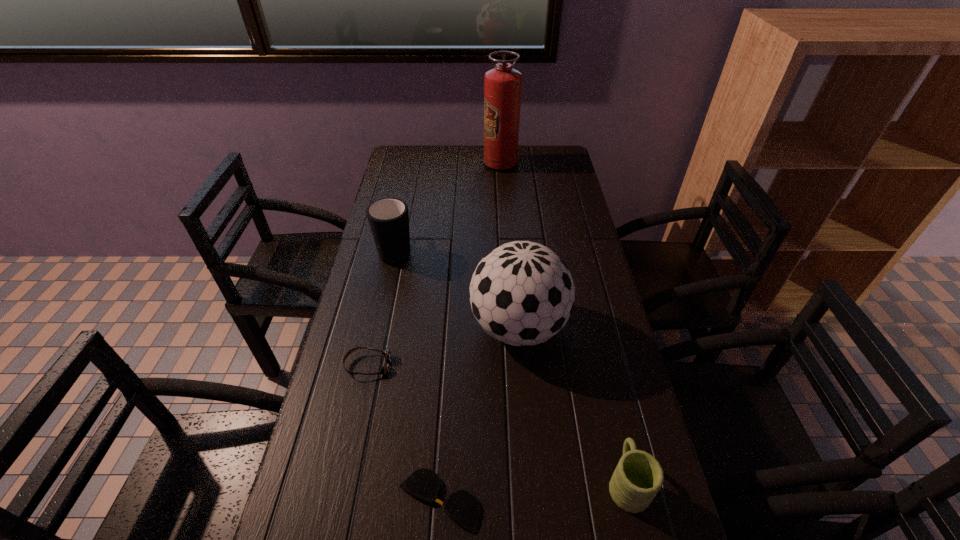
Find the location of a particular element. This screenshot has height=540, width=960. blank space located 0.210m on the label side of the farthest object is located at coordinates (433, 164).

Where is `blank space located 0.330m on the label side of the farthest object`? The height and width of the screenshot is (540, 960). blank space located 0.330m on the label side of the farthest object is located at coordinates (404, 164).

Find the location of a particular element. vacant space located 0.230m on the back of the second tallest object is located at coordinates (512, 244).

Find the location of a particular element. vacant space located on the side of the second farthest object with the handle is located at coordinates (409, 190).

Image resolution: width=960 pixels, height=540 pixels. I want to click on vacant space situated 0.150m on the side of the second farthest object with the handle, so click(x=405, y=207).

The image size is (960, 540). Find the location of `free region located on the side of the second farthest object with the handle`. free region located on the side of the second farthest object with the handle is located at coordinates (407, 196).

Image resolution: width=960 pixels, height=540 pixels. What are the coordinates of `blank space located on the side of the nearer mug with the handle` in the screenshot? It's located at (606, 392).

Find the location of `free location located on the side of the nearer mug with the handle`. free location located on the side of the nearer mug with the handle is located at coordinates (588, 314).

Where is `vacant space located 0.160m on the side of the nearer mug with the handle`? This screenshot has width=960, height=540. vacant space located 0.160m on the side of the nearer mug with the handle is located at coordinates (605, 388).

What are the coordinates of `free location located 0.050m on the front-facing side of the second shortest object` in the screenshot? It's located at (410, 365).